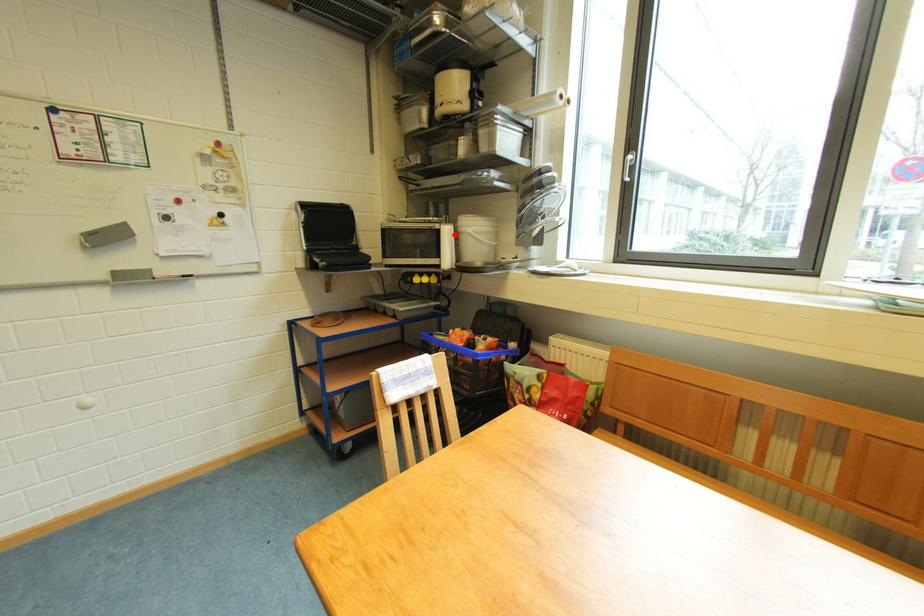
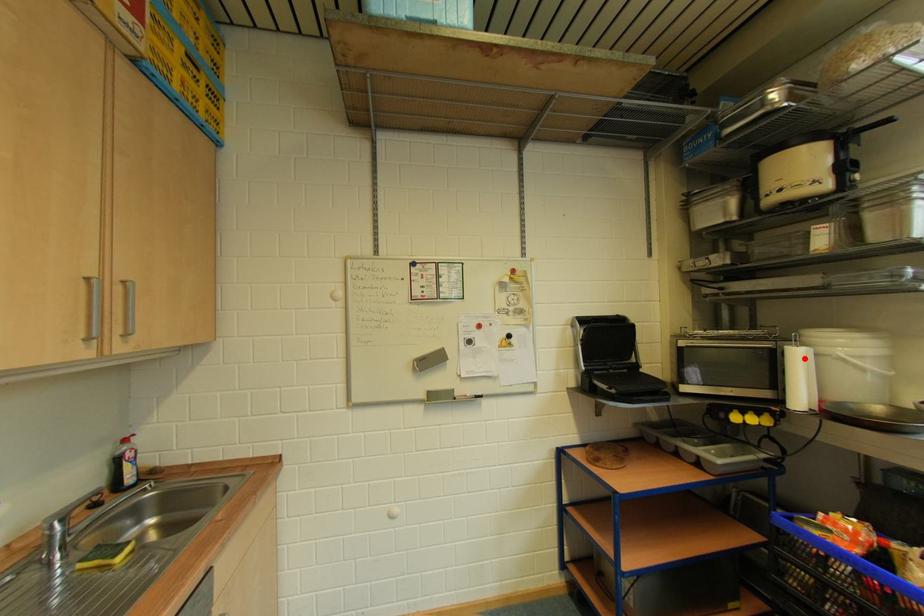
I am providing you with two images of the same scene from different viewpoints. A red point is marked on the first image and another point is marked on the second image. Does the point marked in image1 correspond to the same location as the one in image2?

Yes